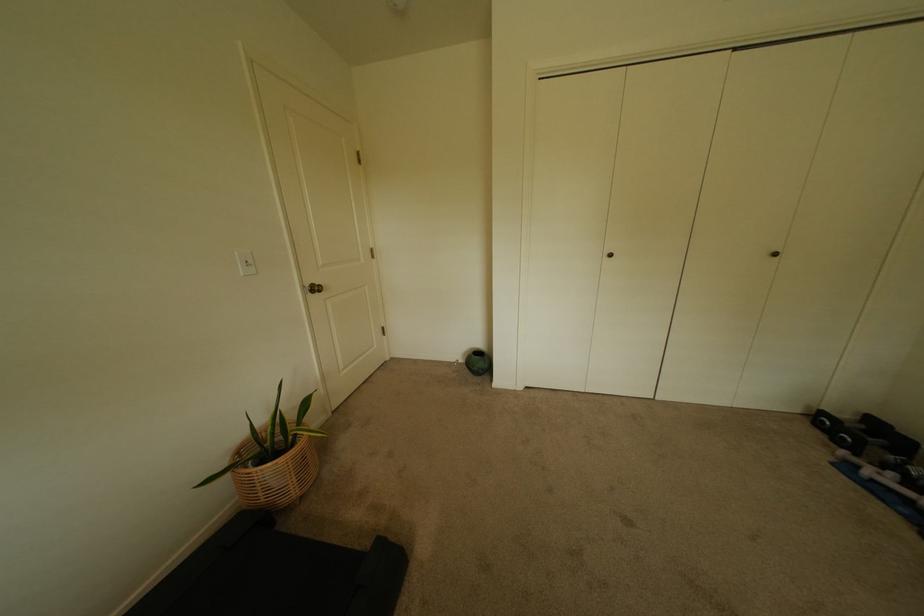
Where would you toggl the white light switch? Please return your answer as a coordinate pair (x, y).

(246, 262)